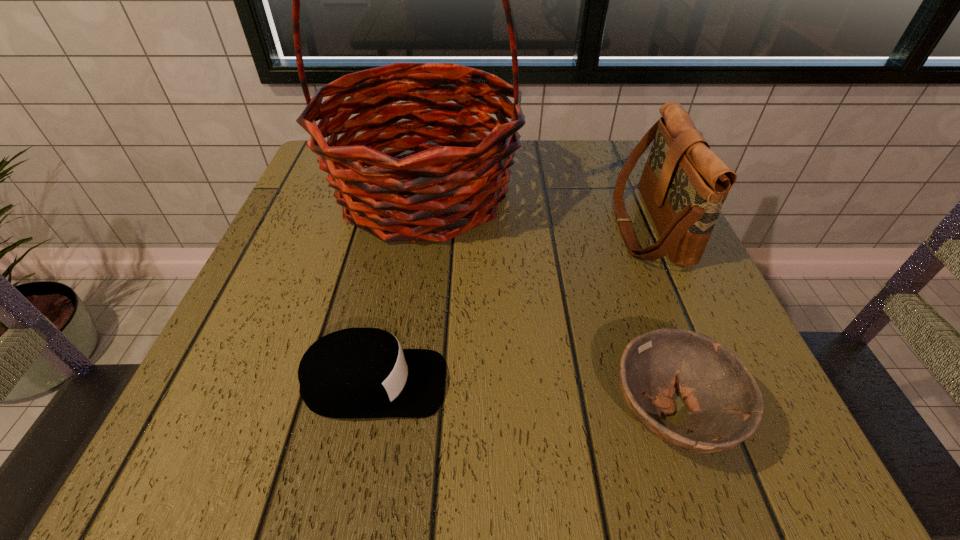
Locate an element on the screen. basket present at the far edge is located at coordinates (460, 171).

You are a GUI agent. You are given a task and a screenshot of the screen. Output one action in this format:
    pyautogui.click(x=<x>, y=<y>)
    Task: Click on the shoulder bag located in the far edge section of the desktop
    This screenshot has width=960, height=540.
    Given the screenshot: What is the action you would take?
    [684, 184]

Locate an element on the screen. The width and height of the screenshot is (960, 540). cap that is at the near edge is located at coordinates (354, 373).

Where is `bowl that is at the near edge`? The width and height of the screenshot is (960, 540). bowl that is at the near edge is located at coordinates (725, 403).

I want to click on basket at the left edge, so click(460, 171).

Image resolution: width=960 pixels, height=540 pixels. What are the coordinates of `cap at the left edge` in the screenshot? It's located at (354, 373).

You are a GUI agent. You are given a task and a screenshot of the screen. Output one action in this format:
    pyautogui.click(x=<x>, y=<y>)
    Task: Click on the shoulder bag that is at the right edge
    
    Given the screenshot: What is the action you would take?
    (x=684, y=184)

The height and width of the screenshot is (540, 960). Find the location of `bowl that is at the right edge`. bowl that is at the right edge is located at coordinates (725, 403).

Identify the location of object that is positioned at the far left corner. (460, 171).

I want to click on object at the near left corner, so click(x=354, y=373).